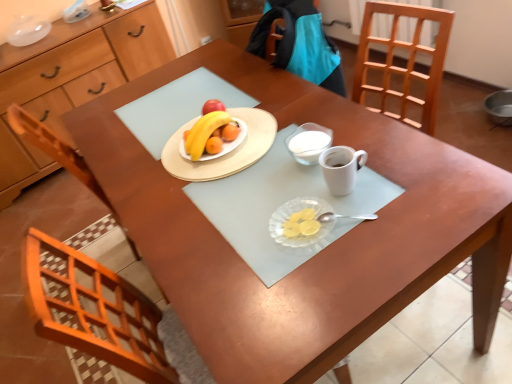
You are a GUI agent. You are given a task and a screenshot of the screen. Output one action in this format:
    pyautogui.click(x=<x>, y=<y>)
    Task: Click on the vacant area that lies between white matte coffee cup at center and yellow matte grapefruit at center
    Image resolution: width=512 pixels, height=384 pixels.
    Given the screenshot: What is the action you would take?
    pyautogui.click(x=273, y=168)